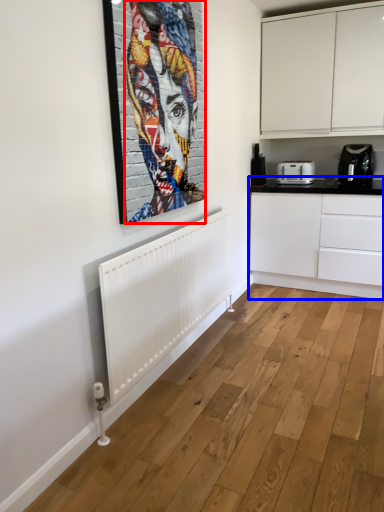
Question: Which point is closer to the camera, person (highlighted by a red box) or counter top (highlighted by a blue box)?

Choices:
 (A) person
 (B) counter top

Answer: (A)